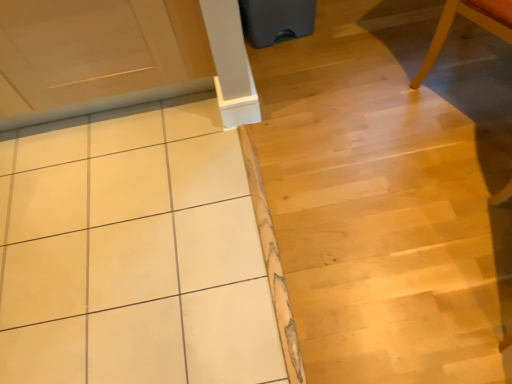
Question: Is white glossy tile at center oriented away from white tile at upper left?

Choices:
 (A) no
 (B) yes

Answer: (B)

Question: Is white glossy tile at center thinner than white tile at upper left?

Choices:
 (A) yes
 (B) no

Answer: (A)

Question: Can you confirm if white glossy tile at center is bigger than white tile at upper left?

Choices:
 (A) yes
 (B) no

Answer: (B)

Question: Can you confirm if white glossy tile at center is wider than white tile at upper left?

Choices:
 (A) no
 (B) yes

Answer: (A)

Question: Is white tile at upper left located within white glossy tile at center?

Choices:
 (A) yes
 (B) no

Answer: (A)

Question: Is white glossy tile at center located outside white tile at upper left?

Choices:
 (A) yes
 (B) no

Answer: (B)

Question: Is white tile at upper left positioned with its back to light wood chair at upper right?

Choices:
 (A) yes
 (B) no

Answer: (B)

Question: From a real-world perspective, is white tile at upper left physically above light wood chair at upper right?

Choices:
 (A) no
 (B) yes

Answer: (A)

Question: Is the position of white tile at upper left more distant than that of light wood chair at upper right?

Choices:
 (A) yes
 (B) no

Answer: (A)

Question: From the image's perspective, is white tile at upper left beneath light wood chair at upper right?

Choices:
 (A) yes
 (B) no

Answer: (A)

Question: Are white tile at upper left and light wood chair at upper right making contact?

Choices:
 (A) no
 (B) yes

Answer: (A)

Question: From a real-world perspective, is white tile at upper left beneath light wood chair at upper right?

Choices:
 (A) yes
 (B) no

Answer: (A)

Question: Is light wood chair at upper right outside of white tile at upper left?

Choices:
 (A) yes
 (B) no

Answer: (A)